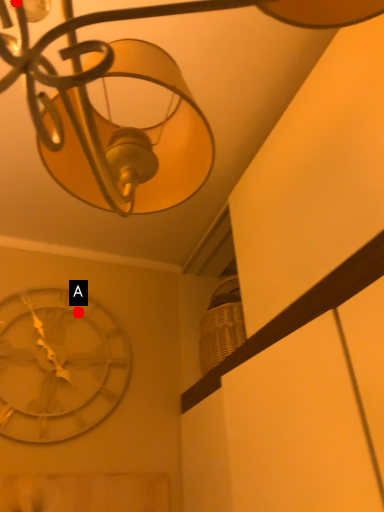
Question: Two points are circled on the image, labeled by A and B beside each circle. Which of the following is the closest to the observer?

Choices:
 (A) A is closer
 (B) B is closer

Answer: (B)